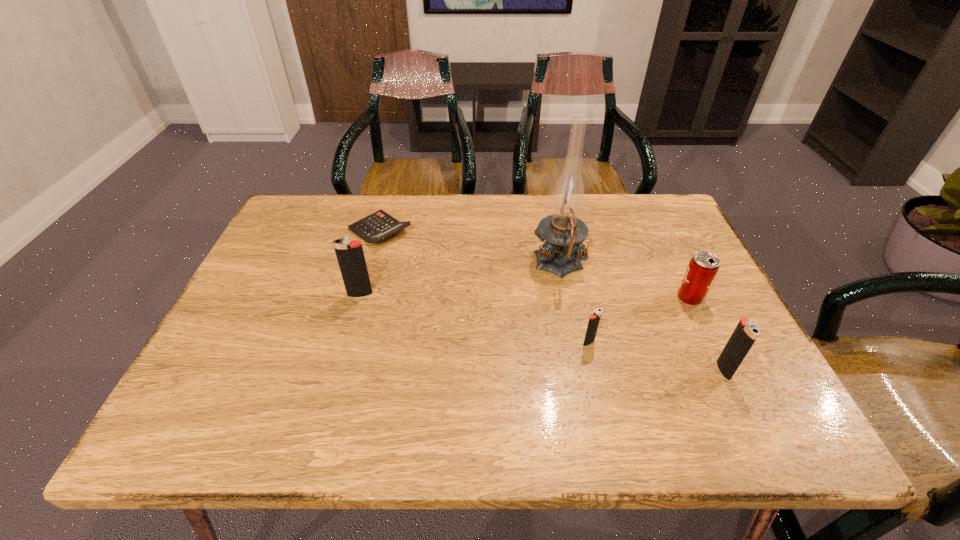
This screenshot has width=960, height=540. In order to click on free space between the second nearest object and the nearest object in this screenshot , I will do `click(656, 356)`.

The image size is (960, 540). Identify the location of vacant space in between the third shortest object and the calculator. (535, 264).

Locate an element on the screen. free spot between the fifth farthest object and the leftmost igniter is located at coordinates (474, 318).

Identify the location of vacant space that's between the oil lamp and the shortest igniter. The width and height of the screenshot is (960, 540). pos(574,303).

You are a GUI agent. You are given a task and a screenshot of the screen. Output one action in this format:
    pyautogui.click(x=<x>, y=<y>)
    Task: Click on the vacant area that lies between the shortest igniter and the leftmost igniter
    
    Given the screenshot: What is the action you would take?
    pyautogui.click(x=474, y=318)

Find the location of `object that is the fourth closest one to the shortest igniter`. object that is the fourth closest one to the shortest igniter is located at coordinates (350, 255).

This screenshot has height=540, width=960. Identify the location of the fourth closest object relative to the fourth tallest object. (378, 226).

Identify the location of igniter that can be found as the closest to the leftmost igniter. This screenshot has height=540, width=960. (594, 319).

The image size is (960, 540). I want to click on the second closest igniter to the fourth tallest object, so click(594, 319).

Find the location of a particular element. Image resolution: width=960 pixels, height=540 pixels. vacant space that satisfies the following two spatial constraints: 1. on the back side of the rightmost igniter; 2. on the right side of the third shortest object is located at coordinates (688, 298).